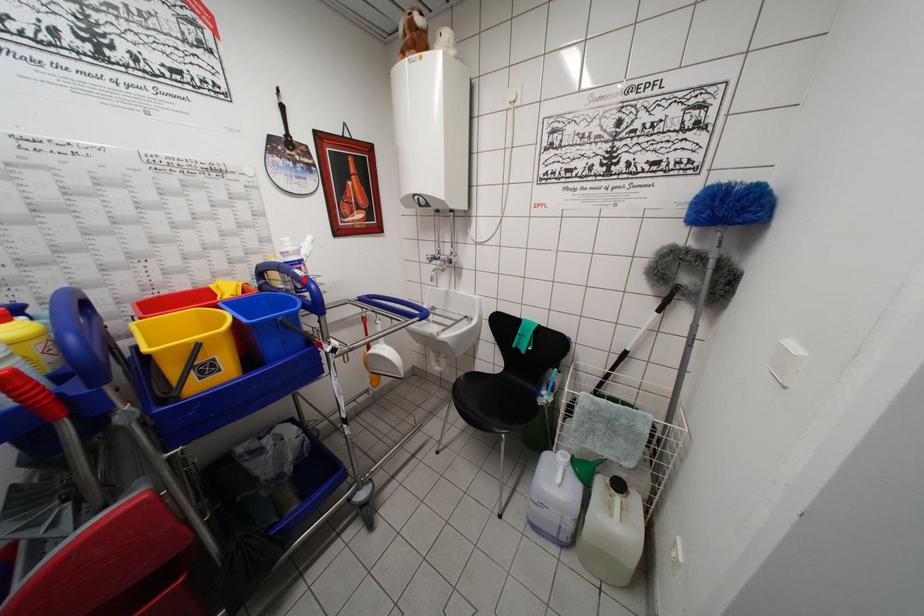
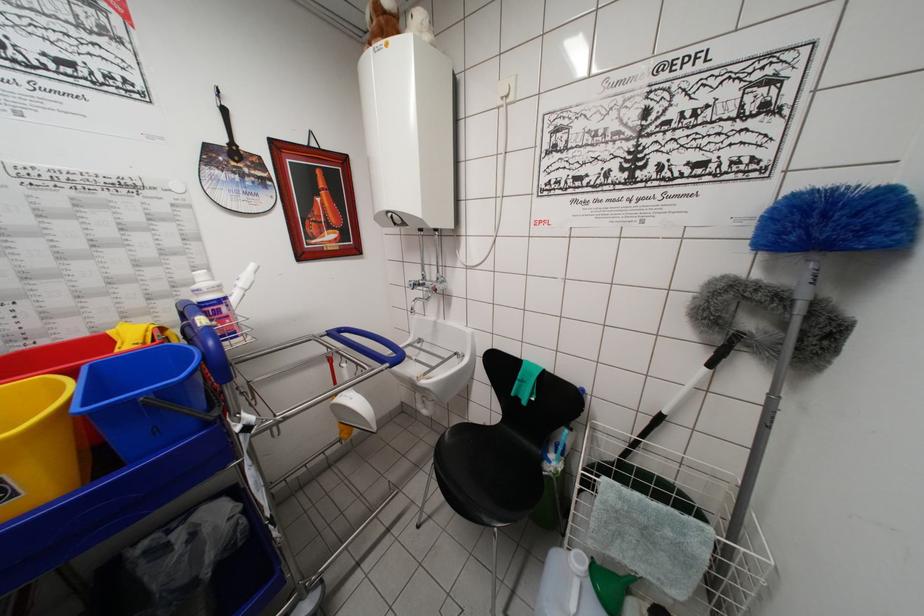
The point at the highlighted location is marked in the first image. Where is the corresponding point in the second image?

(202, 330)